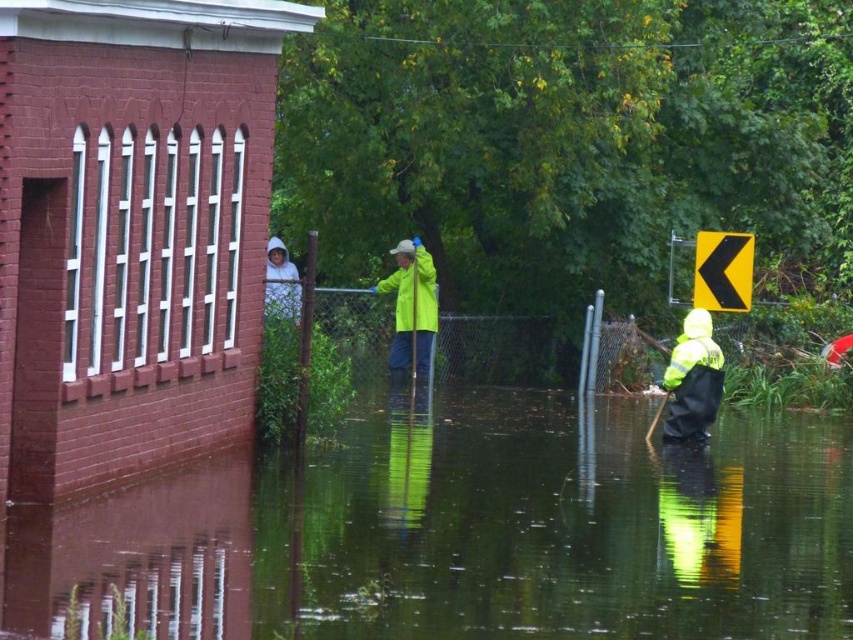
Question: Considering the real-world distances, which object is closest to the white hooded sweatshirt at upper center?

Choices:
 (A) yellow reflective plastic at upper right
 (B) high-visibility yellow safety vest at lower right
 (C) reflective yellow raincoat at center
 (D) neon yellow raincoat at center

Answer: (D)

Question: Does reflective yellow raincoat at center have a lesser width compared to neon yellow raincoat at center?

Choices:
 (A) yes
 (B) no

Answer: (A)

Question: Among these points, which one is nearest to the camera?

Choices:
 (A) (233, 628)
 (B) (715, 344)
 (C) (390, 278)
 (D) (732, 262)

Answer: (A)

Question: Among these points, which one is nearest to the camera?

Choices:
 (A) (683, 364)
 (B) (689, 422)
 (C) (287, 273)
 (D) (654, 552)

Answer: (D)

Question: Does reflective yellow raincoat at center appear over yellow reflective plastic at upper right?

Choices:
 (A) no
 (B) yes

Answer: (A)

Question: Can you confirm if reflective yellow raincoat at center is positioned above white hooded sweatshirt at upper center?

Choices:
 (A) no
 (B) yes

Answer: (A)